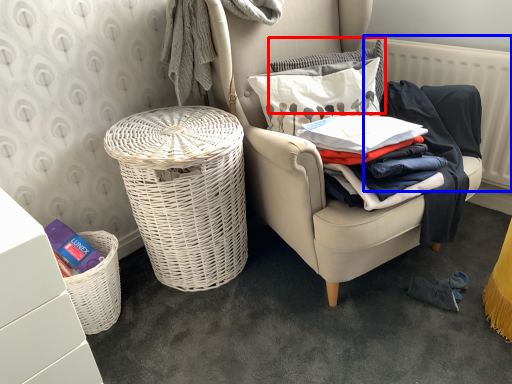
Question: Among these objects, which one is farthest to the camera, pillow (highlighted by a red box) or radiator (highlighted by a blue box)?

Choices:
 (A) pillow
 (B) radiator

Answer: (A)